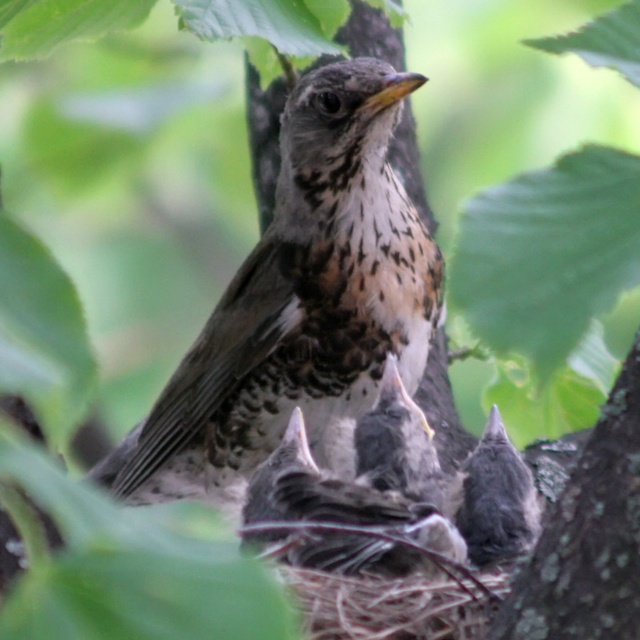
Question: Among these objects, which one is nearest to the camera?

Choices:
 (A) gray speckled feathers at center
 (B) speckled feathered bird at center

Answer: (A)

Question: Is speckled feathered bird at center to the right of gray speckled feathers at center from the viewer's perspective?

Choices:
 (A) no
 (B) yes

Answer: (A)

Question: Can you confirm if speckled feathered bird at center is bigger than gray speckled feathers at center?

Choices:
 (A) yes
 (B) no

Answer: (A)

Question: Which point is closer to the camera taking this photo?

Choices:
 (A) (262, 272)
 (B) (504, 518)

Answer: (B)

Question: In this image, where is speckled feathered bird at center located relative to gray speckled feathers at center?

Choices:
 (A) left
 (B) right

Answer: (A)